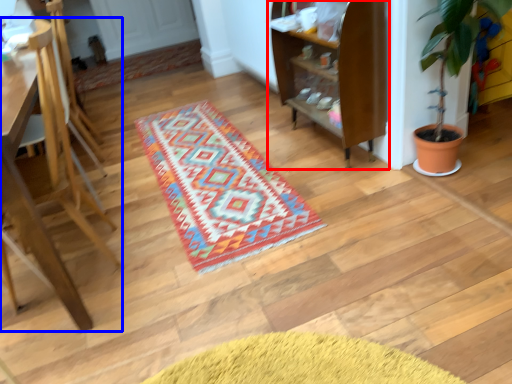
Question: Which object appears closest to the camera in this image, shelf (highlighted by a red box) or furniture (highlighted by a blue box)?

Choices:
 (A) shelf
 (B) furniture

Answer: (B)